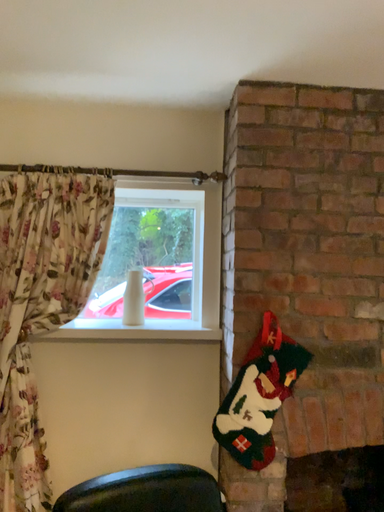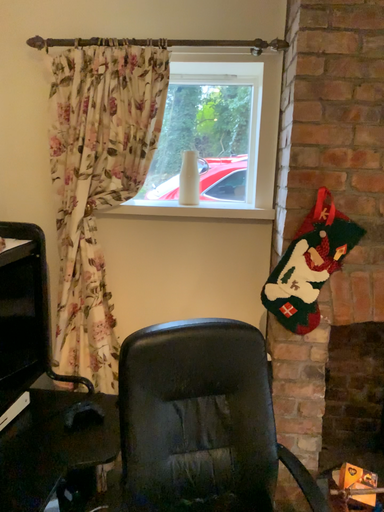
Question: How did the camera likely rotate when shooting the video?

Choices:
 (A) rotated left
 (B) rotated right

Answer: (A)